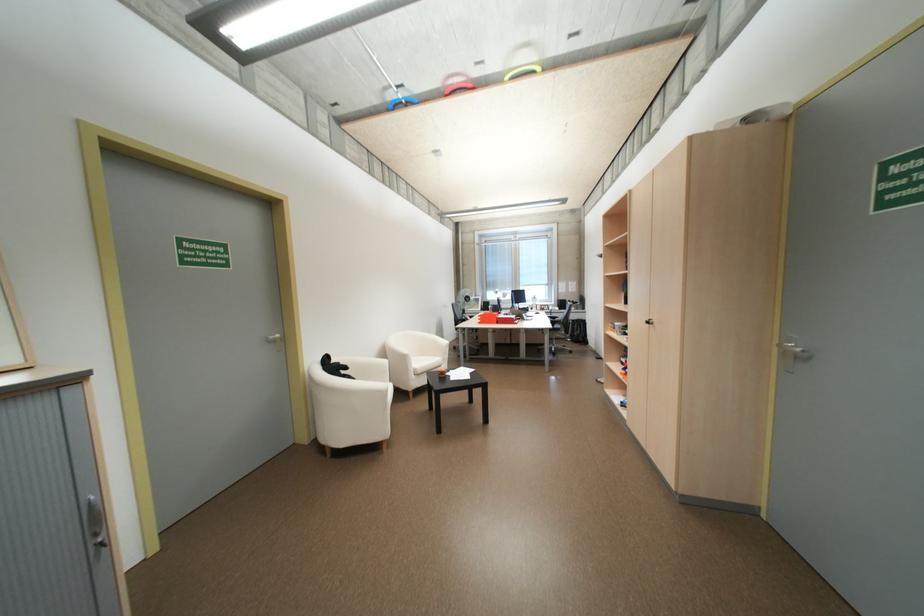
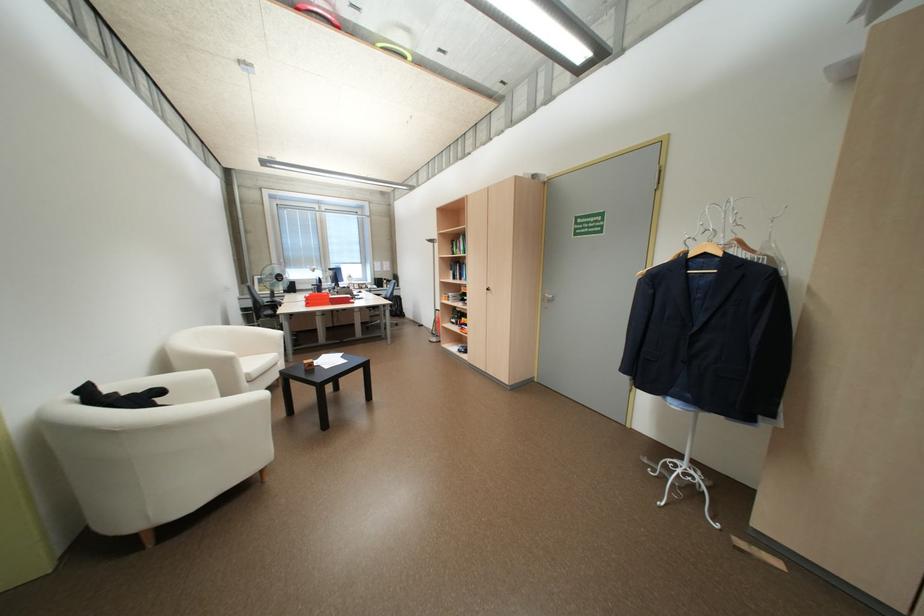
Where in the second image is the point corresponding to pixel 456 95 from the first image?

(309, 9)